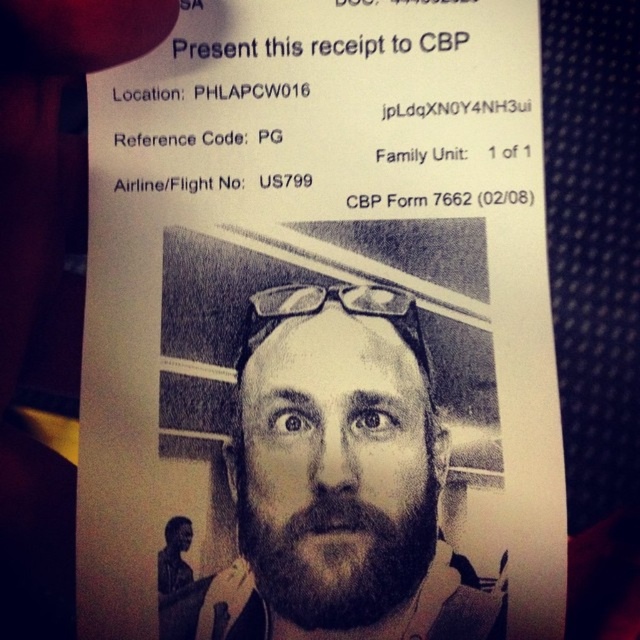
Question: Is beige textured beard at center to the right of dark brown thick beard at center from the viewer's perspective?

Choices:
 (A) no
 (B) yes

Answer: (A)

Question: Can you confirm if beige textured beard at center is positioned above dark brown thick beard at center?

Choices:
 (A) yes
 (B) no

Answer: (A)

Question: Which point is farther to the camera?

Choices:
 (A) beige textured beard at center
 (B) dark brown thick beard at center

Answer: (B)

Question: Which of the following is the farthest from the observer?

Choices:
 (A) dark brown thick beard at center
 (B) beige textured beard at center

Answer: (A)

Question: Can you confirm if beige textured beard at center is positioned to the left of dark brown thick beard at center?

Choices:
 (A) no
 (B) yes

Answer: (B)